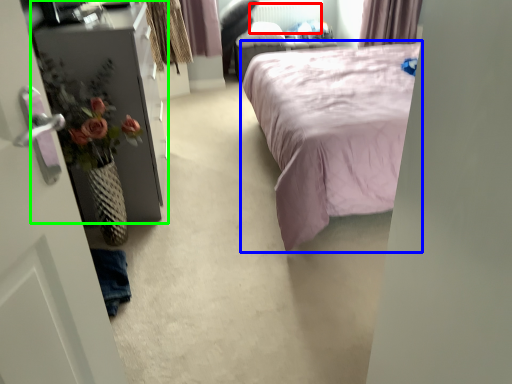
Question: Which is farther away from radiator (highlighted by a red box)? bed (highlighted by a blue box) or furniture (highlighted by a green box)?

Choices:
 (A) bed
 (B) furniture

Answer: (B)